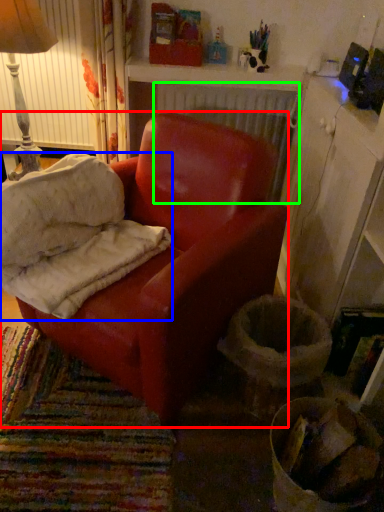
Question: Which object is positioned farthest from chair (highlighted by a red box)? Select from material (highlighted by a blue box) and radiator (highlighted by a green box).

Choices:
 (A) material
 (B) radiator

Answer: (B)